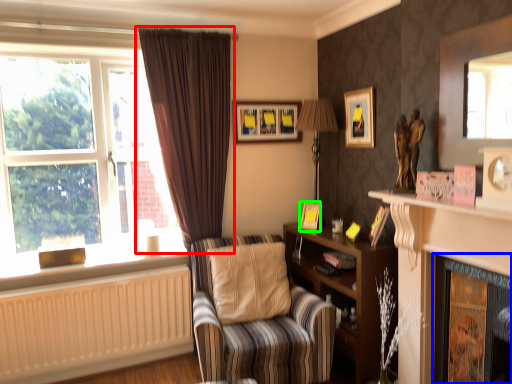
Question: Estimate the real-world distances between objects in this image. Which object is farther from curtain (highlighted by a red box), fireplace (highlighted by a blue box) or picture frame (highlighted by a green box)?

Choices:
 (A) fireplace
 (B) picture frame

Answer: (A)